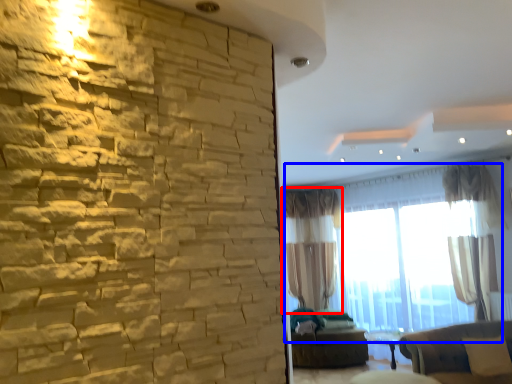
Question: Which of the following is the farthest to the observer, curtain (highlighted by a red box) or window (highlighted by a blue box)?

Choices:
 (A) curtain
 (B) window

Answer: (A)